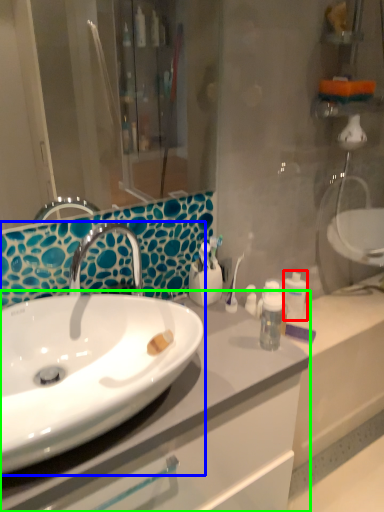
Question: Estimate the real-world distances between objects in this image. Which object is farther from mouthwash (highlighted by a red box), sink (highlighted by a blue box) or bathroom cabinet (highlighted by a green box)?

Choices:
 (A) sink
 (B) bathroom cabinet

Answer: (A)